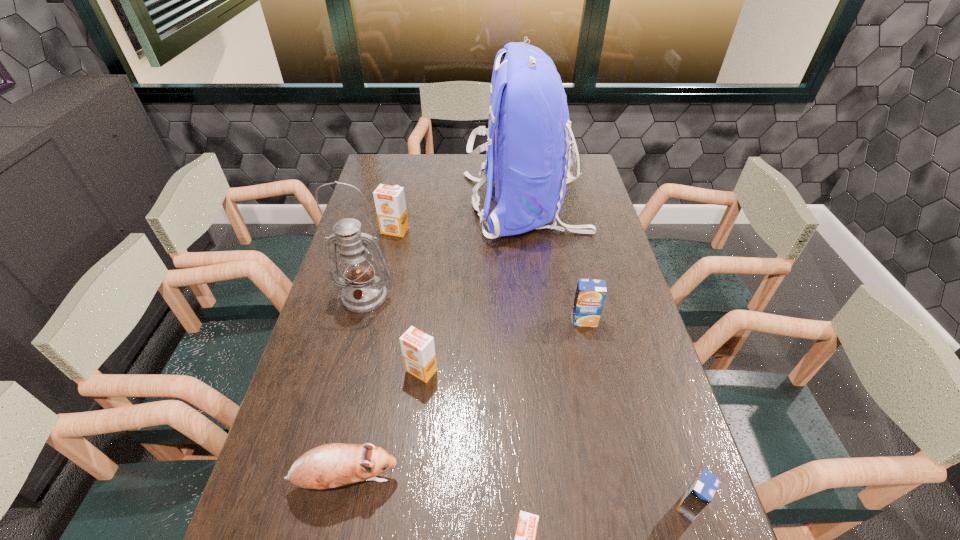
The width and height of the screenshot is (960, 540). I want to click on free spot located at the face of the brown hamster, so click(585, 480).

The height and width of the screenshot is (540, 960). I want to click on vacant space positioned on the left of the second nearest orange juice, so click(x=481, y=505).

In order to click on object that is at the far edge in this screenshot , I will do `click(528, 158)`.

In order to click on oil lamp present at the left edge in this screenshot , I will do click(x=362, y=291).

Identify the location of orange juice located in the left edge section of the desktop. The width and height of the screenshot is (960, 540). (390, 203).

This screenshot has height=540, width=960. I want to click on hamster present at the left edge, so click(331, 465).

Locate an element on the screen. The width and height of the screenshot is (960, 540). backpack that is positioned at the right edge is located at coordinates (528, 158).

Identify the location of object that is at the far right corner. This screenshot has width=960, height=540. (528, 158).

Locate an element on the screen. vacant space at the far edge of the desktop is located at coordinates (427, 184).

I want to click on vacant space at the left edge of the desktop, so click(x=371, y=186).